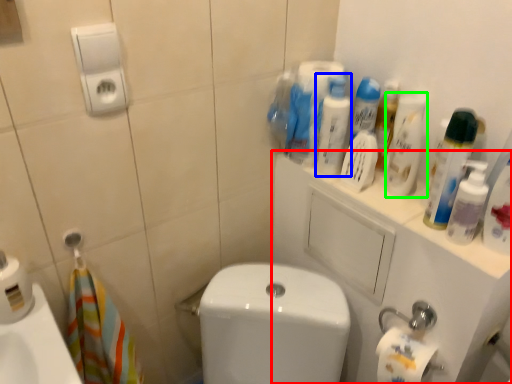
Question: Considering the real-world distances, which object is closest to porcelain (highlighted by a red box)? cleaning product (highlighted by a blue box) or cleaning product (highlighted by a green box).

Choices:
 (A) cleaning product
 (B) cleaning product

Answer: (B)